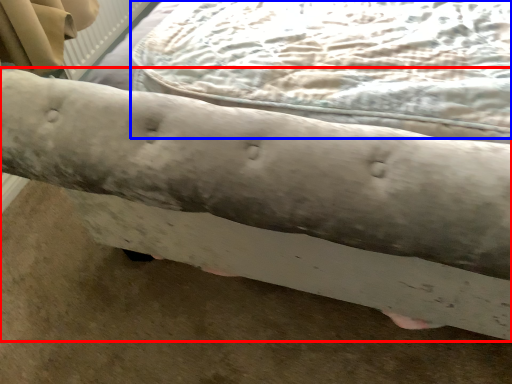
Question: Which object appears closest to the camera in this image, furniture (highlighted by a red box) or sheet (highlighted by a blue box)?

Choices:
 (A) furniture
 (B) sheet

Answer: (A)